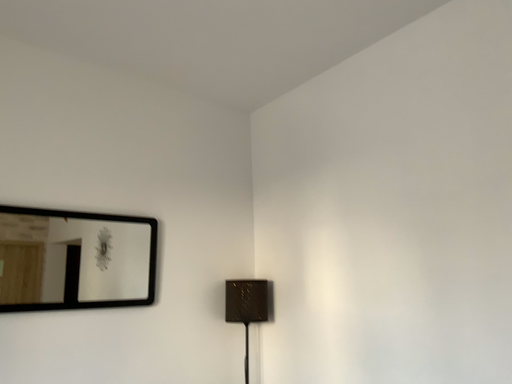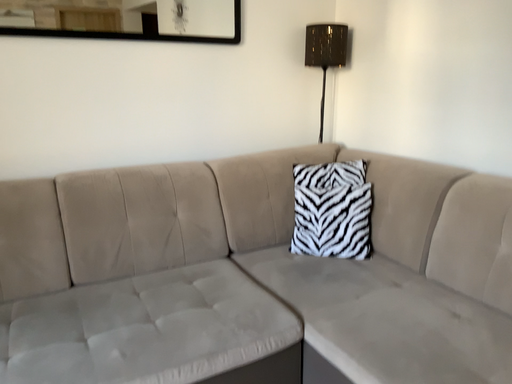
Question: Which way did the camera rotate in the video?

Choices:
 (A) rotated right
 (B) rotated left

Answer: (B)